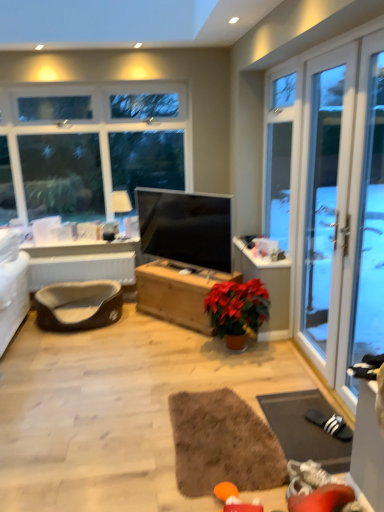
Question: Considering the positions of point 84,311 and point 170,197, is point 84,311 closer or farther from the camera than point 170,197?

Choices:
 (A) closer
 (B) farther

Answer: (A)

Question: Is brown plush pet bed at lower left to the left or to the right of matte black tv at center in the image?

Choices:
 (A) left
 (B) right

Answer: (A)

Question: Based on their relative distances, which object is nearer to the brown plush pet bed at lower left?

Choices:
 (A) matte brown wooden chest at center
 (B) brown fabric pet bed at lower left
 (C) matte black tv at center
 (D) transparent glass screen door at right
 (E) brown shaggy rug at center, the second yoga mat viewed from the right

Answer: (B)

Question: Which is farther from the brown shaggy rug at center, the second yoga mat viewed from the right?

Choices:
 (A) brown fabric pet bed at lower left
 (B) matte white lampshade at upper left
 (C) wooden chest at center
 (D) transparent glass screen door at right
 (E) matte black tv at center

Answer: (B)